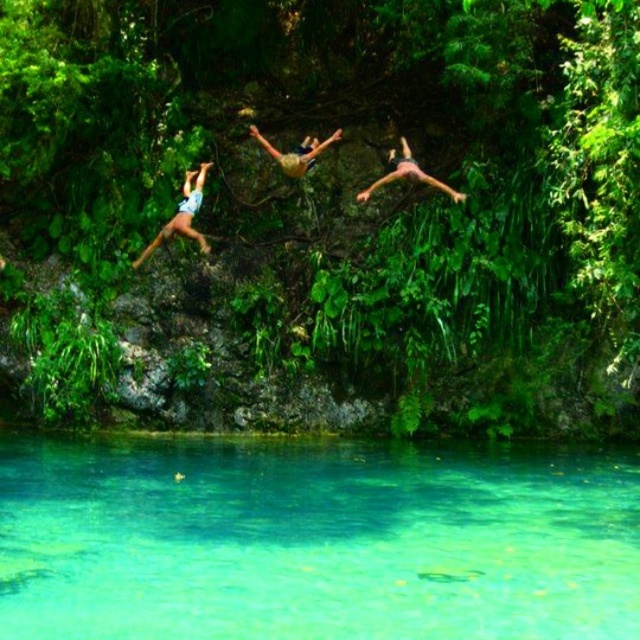
Describe the element at coordinates (182, 214) in the screenshot. I see `light blue denim shorts at left` at that location.

Between point (141, 252) and point (449, 188), which one is positioned in front?

Point (141, 252) is more forward.

Between point (186, 198) and point (461, 195), which one is positioned in front?

Positioned in front is point (186, 198).

This screenshot has height=640, width=640. I want to click on light blue denim shorts at left, so click(182, 214).

Does transparent water at lower center appear over camouflage shorts at center?

No, transparent water at lower center is not above camouflage shorts at center.

Does transparent water at lower center lie in front of camouflage shorts at center?

That is True.

Is point (45, 492) closer to viewer compared to point (280, 161)?

Yes, point (45, 492) is closer to viewer.

You are a GUI agent. You are given a task and a screenshot of the screen. Output one action in this format:
    pyautogui.click(x=<x>, y=<y>)
    Task: Click on the transparent water at lower center
    The width and height of the screenshot is (640, 640).
    Given the screenshot: What is the action you would take?
    pyautogui.click(x=314, y=541)

Between light blue denim shorts at left and camouflage shorts at center, which one has more height?

With more height is light blue denim shorts at left.

Is light blue denim shorts at left smaller than camouflage shorts at center?

Incorrect, light blue denim shorts at left is not smaller in size than camouflage shorts at center.

Is point (200, 186) closer to camera compared to point (304, 170)?

Yes.

At what (x,y) coordinates should I click in order to perform the action: click on light blue denim shorts at left. Please return your answer as a coordinate pair (x, y). This screenshot has width=640, height=640. Looking at the image, I should click on (182, 214).